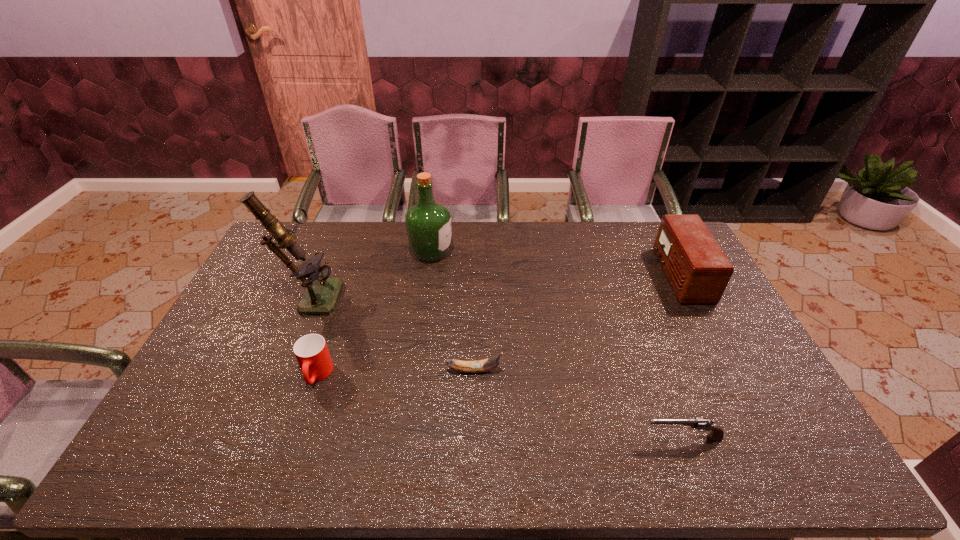
What are the coordinates of `microscope` in the screenshot? It's located at (321, 293).

The width and height of the screenshot is (960, 540). What are the coordinates of `the second tallest object` in the screenshot? It's located at (428, 223).

Identify the location of the third object from left to right. This screenshot has width=960, height=540. (428, 223).

Identify the location of radio receiver. (698, 270).

Locate an element on the screen. This screenshot has width=960, height=540. the third tallest object is located at coordinates (698, 270).

Where is `the fourth tallest object`? The height and width of the screenshot is (540, 960). the fourth tallest object is located at coordinates (311, 351).

The image size is (960, 540). I want to click on the fourth object from left to right, so click(x=490, y=363).

This screenshot has height=540, width=960. In order to click on the second object from right to left in this screenshot , I will do `click(717, 433)`.

Locate an element on the screen. The width and height of the screenshot is (960, 540). gun is located at coordinates (717, 433).

Locate an element on the screen. This screenshot has height=540, width=960. blank space located 0.270m at the eyepiece of the microscope is located at coordinates (421, 294).